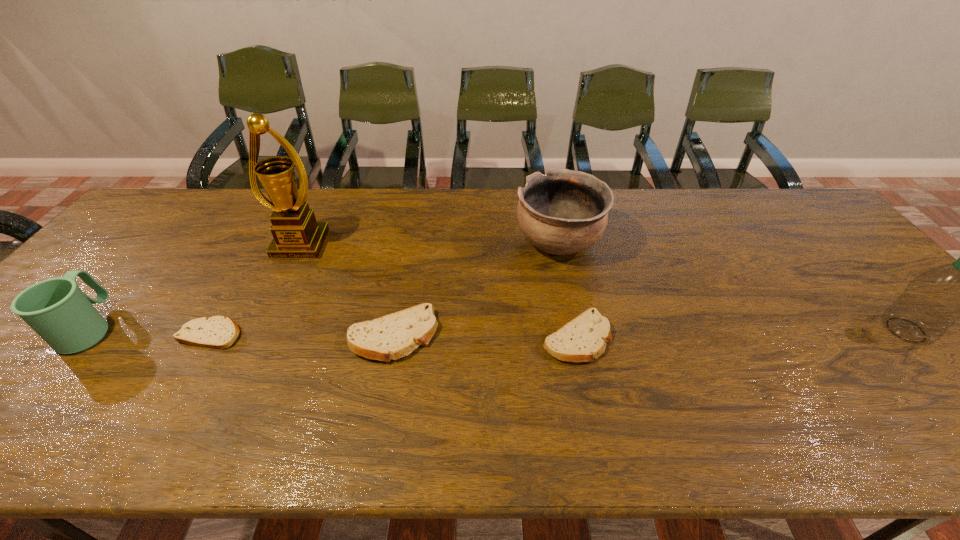
Where is `free area in between the second tallest object and the leftmost object`? The height and width of the screenshot is (540, 960). free area in between the second tallest object and the leftmost object is located at coordinates (498, 329).

Identify the location of free area in between the award and the mug. (195, 286).

At what (x,y) coordinates should I click in order to perform the action: click on free space that is in between the rightmost object and the fourth object from left to right. Please return your answer as a coordinate pair (x, y). This screenshot has height=540, width=960. Looking at the image, I should click on point(649,333).

Identify the location of free space between the sixth tallest object and the mug. This screenshot has height=540, width=960. click(333, 333).

This screenshot has width=960, height=540. Find the location of `free spot between the fifth tallest object and the rightmost object`. free spot between the fifth tallest object and the rightmost object is located at coordinates (649, 333).

This screenshot has width=960, height=540. I want to click on empty space that is in between the fourth object from right to left and the rightmost object, so click(x=649, y=333).

Identify which object is located as the fourth nearest to the water bottle. Please provide its 2D coordinates. Your answer should be formatted as a tuple, i.e. [(x, y)], where the tuple contains the x and y coordinates of a point satisfying the conditions above.

[(296, 234)]

At what (x,y) coordinates should I click in order to perform the action: click on object that is the second closest one to the fourth object from left to right. Please return your answer as a coordinate pair (x, y). This screenshot has width=960, height=540. Looking at the image, I should click on (584, 338).

Select which pita bread is the second closest to the leftmost pita bread. Please provide its 2D coordinates. Your answer should be formatted as a tuple, i.e. [(x, y)], where the tuple contains the x and y coordinates of a point satisfying the conditions above.

[(584, 338)]

The image size is (960, 540). I want to click on pita bread object that ranks as the closest to the third shortest object, so click(584, 338).